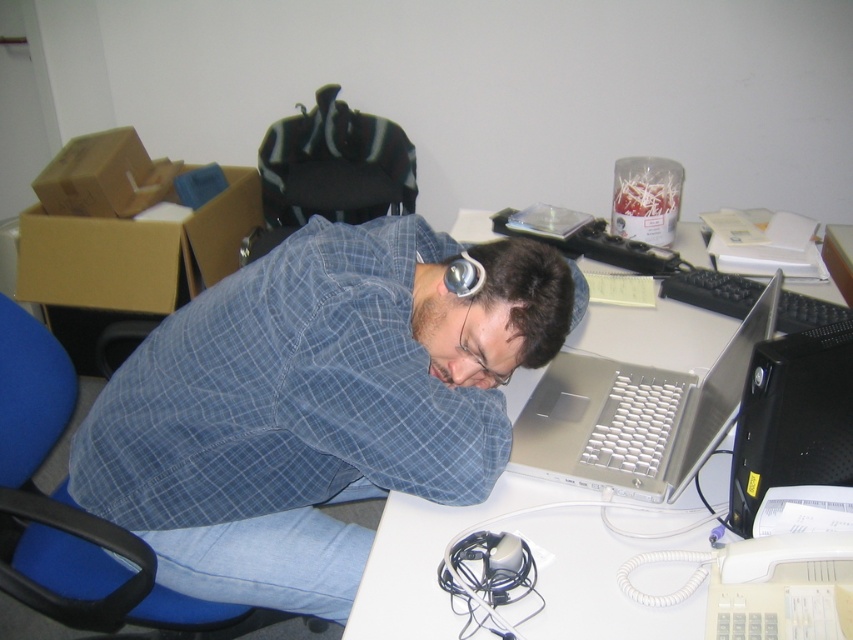
What object is located at the coordinates point (x=428, y=560)?

The white plastic computer desk at center is located at point (x=428, y=560).

You are an office assistant who needs to locate the silver metallic laptop at center. According to the coordinates provided, where would you find it on the desk?

The silver metallic laptop at center is located at coordinates point (635, 416).

You are organizing the desk items. You need to place a new item between the silver metallic laptop at center and the black plastic desktop computer at right. Is there enough space between them to fit a 10 cm wide item?

The silver metallic laptop at center is to the left of the black plastic desktop computer at right, so there is space between them. Since the item is only 10 cm wide, it should fit between them.